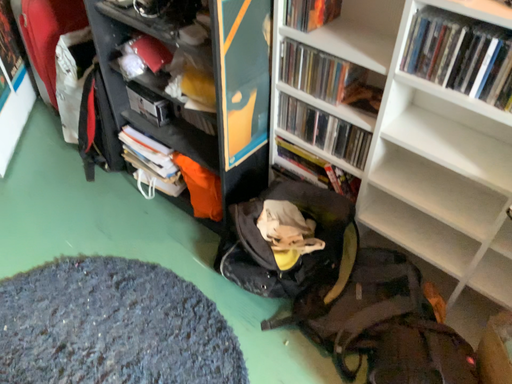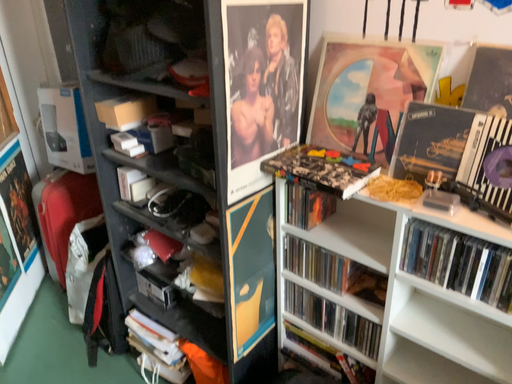
Question: How did the camera likely rotate when shooting the video?

Choices:
 (A) rotated upward
 (B) rotated downward

Answer: (A)